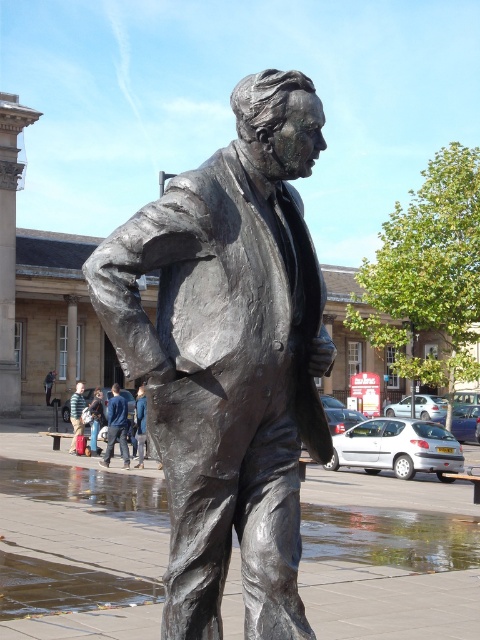
In the scene shown: You are a tour guide leading a group to the bronze statue at center. Your group is currently standing 10 feet away from the statue. Can you safely approach closer to the statue to give a detailed explanation?

The bronze statue at center is 12.19 feet away from the viewer. Since your group is already 10 feet away, you can move closer by approximately 2.19 feet to reach the statue safely for a detailed explanation.

You are a photographer planning to take a photo of the bronze statue at center and the blue denim jeans at center. Since you want both subjects to appear balanced in the frame, which object should you place closer to the camera to achieve this?

The blue denim jeans at center should be placed closer to the camera because it is smaller in size than the bronze statue at center, making them appear larger in the photo to balance both subjects.